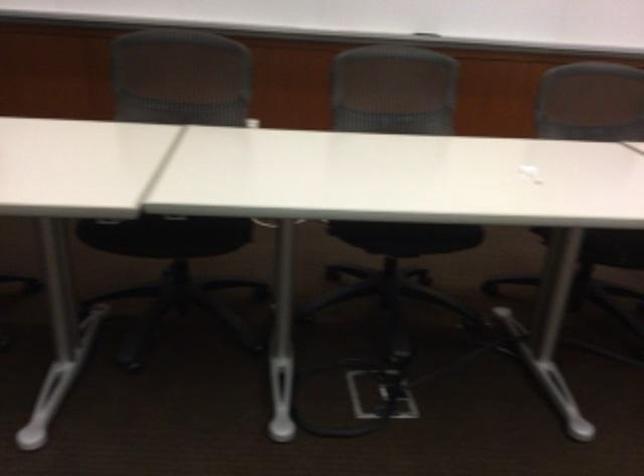
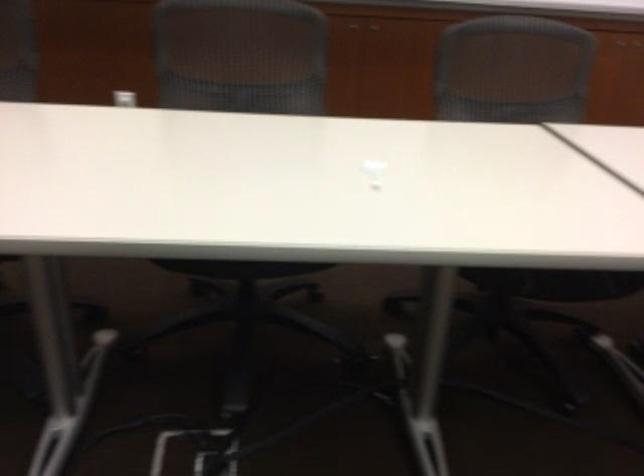
The point at (409, 248) is marked in the first image. Where is the corresponding point in the second image?

(239, 268)